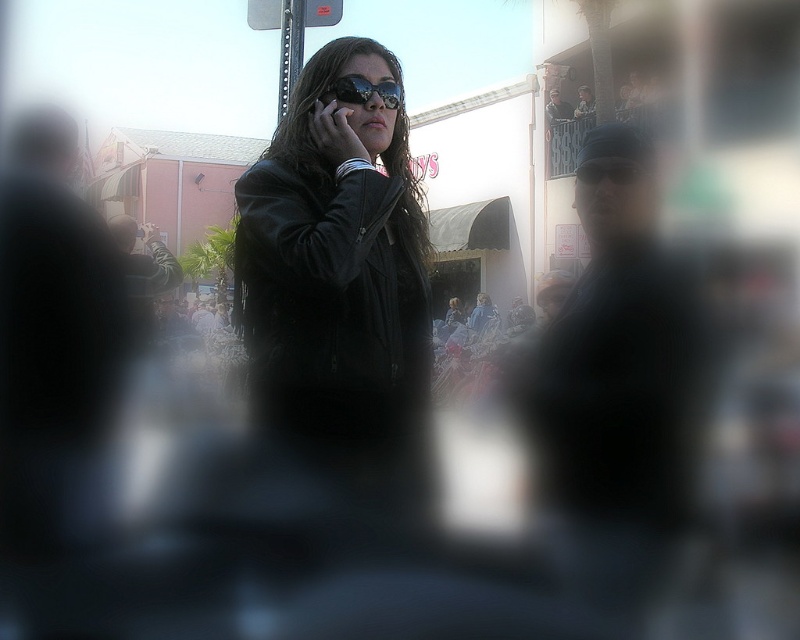
Question: Estimate the real-world distances between objects in this image. Which object is closer to the black matte smartphone at center?

Choices:
 (A) black leather jacket at center
 (B) sunglasses at center

Answer: (B)

Question: Can you confirm if black leather jacket at center is positioned above sunglasses at center?

Choices:
 (A) yes
 (B) no

Answer: (B)

Question: Does black leather jacket at center lie in front of black matte smartphone at center?

Choices:
 (A) yes
 (B) no

Answer: (A)

Question: From the image, what is the correct spatial relationship of sunglasses at center in relation to black matte smartphone at center?

Choices:
 (A) below
 (B) above

Answer: (B)

Question: Which object is positioned closest to the black matte smartphone at center?

Choices:
 (A) black leather jacket at center
 (B) sunglasses at center

Answer: (B)

Question: Which object is closer to the camera taking this photo?

Choices:
 (A) black leather jacket at center
 (B) black matte smartphone at center
 (C) sunglasses at center

Answer: (A)